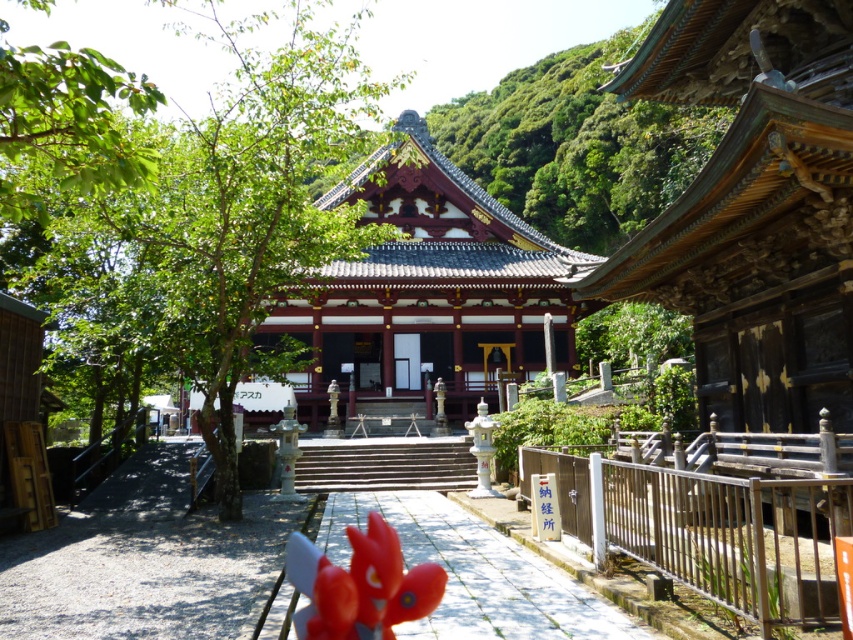
Question: Which of these objects is positioned farthest from the green leafy tree at center?

Choices:
 (A) shiny red wood pagoda at center
 (B) green leafy tree at upper center

Answer: (B)

Question: Can you confirm if green leafy tree at center is wider than green leafy tree at upper center?

Choices:
 (A) yes
 (B) no

Answer: (A)

Question: From the image, what is the correct spatial relationship of green leafy tree at center in relation to green leafy tree at upper center?

Choices:
 (A) above
 (B) below

Answer: (B)

Question: Is green leafy tree at center to the right of shiny red wood pagoda at center from the viewer's perspective?

Choices:
 (A) yes
 (B) no

Answer: (B)

Question: Estimate the real-world distances between objects in this image. Which object is closer to the green leafy tree at upper center?

Choices:
 (A) shiny red wood pagoda at center
 (B) green leafy tree at center

Answer: (B)

Question: Which point is closer to the camera?

Choices:
 (A) green leafy tree at center
 (B) green leafy tree at upper center
 (C) shiny red wood pagoda at center

Answer: (A)